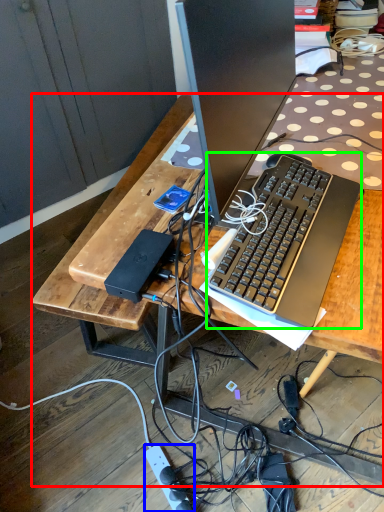
Question: Estimate the real-world distances between objects in this image. Which object is closer to desk (highlighted by a red box), power outlet (highlighted by a blue box) or computer keyboard (highlighted by a green box)?

Choices:
 (A) power outlet
 (B) computer keyboard

Answer: (B)